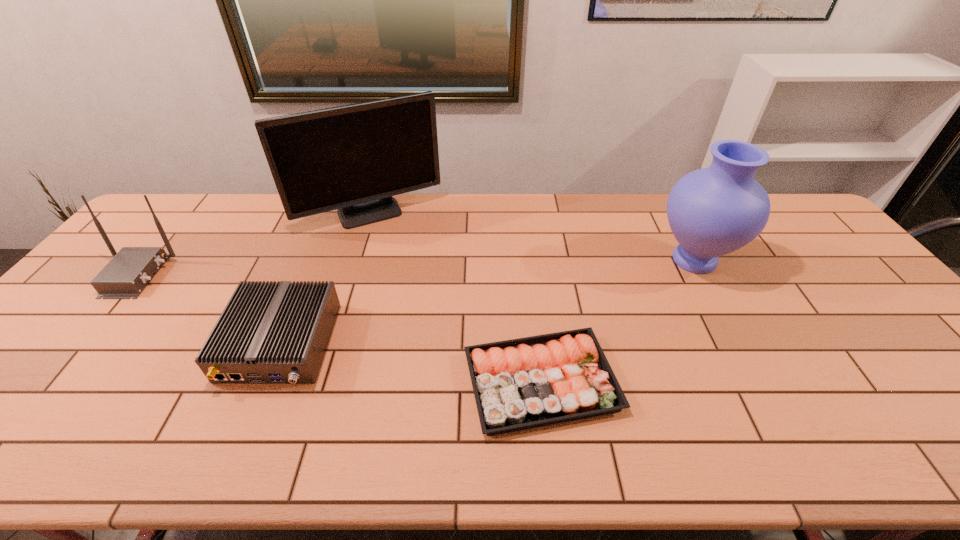
In the image, there is a desktop. Where is `free space at the far right corner`? free space at the far right corner is located at coordinates (795, 205).

Identify the location of unoccupied area between the third tallest object and the rightmost object. This screenshot has width=960, height=540. (415, 268).

Find the location of `vacant space that's between the platter and the third shortest object`. vacant space that's between the platter and the third shortest object is located at coordinates (339, 329).

The height and width of the screenshot is (540, 960). In order to click on free space between the second object from right to left and the third shortest object in this screenshot , I will do coord(339,329).

Identify the location of vacant region between the shorter router and the computer monitor. (325, 279).

Where is `free space between the computer monitor and the shorter router`? The width and height of the screenshot is (960, 540). free space between the computer monitor and the shorter router is located at coordinates click(325, 279).

In order to click on vacant area that lies between the platter and the computer monitor in this screenshot , I will do `click(456, 299)`.

At what (x,y) coordinates should I click in order to perform the action: click on free point between the computer monitor and the rightmost object. Please return your answer as a coordinate pair (x, y). The image size is (960, 540). Looking at the image, I should click on (533, 238).

At what (x,y) coordinates should I click in order to perform the action: click on free space between the platter and the computer monitor. Please return your answer as a coordinate pair (x, y). Looking at the image, I should click on (456, 299).

Locate an element on the screen. Image resolution: width=960 pixels, height=540 pixels. vacant area between the computer monitor and the vase is located at coordinates (533, 238).